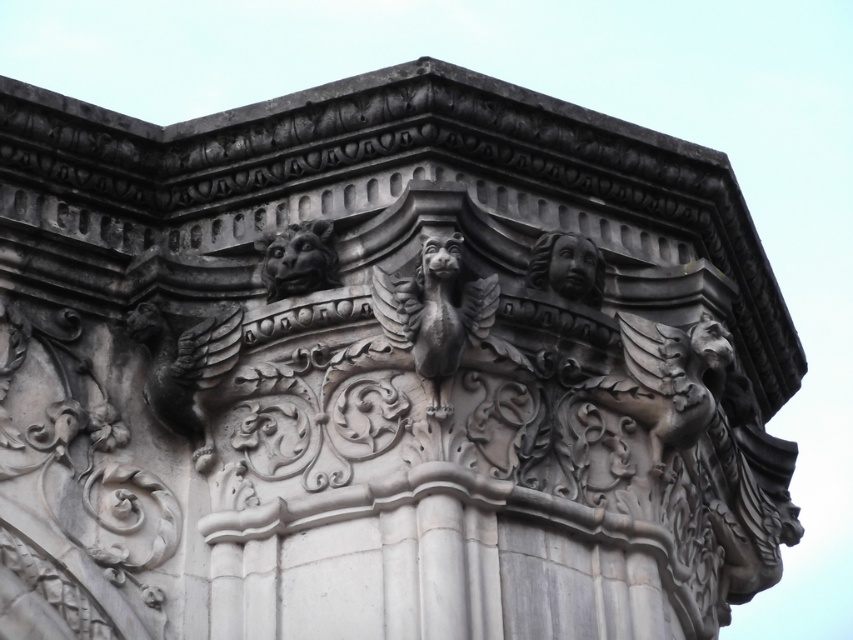
You are an architect examining the intricate carvings on a historical building. You notice a point marked at coordinates (434, 314). What does this point correspond to in the scene?

The point at coordinates (434, 314) corresponds to the dark gray stone gargoyle at center.

You are an architect designing a replica of this architectural detail. You need to ensure that the matte stone lion at upper center and the polished stone face at upper right are proportionate. Which object should you make wider to match the other?

The matte stone lion at upper center is thinner than the polished stone face at upper right, so you should make the matte stone lion at upper center wider to match the other.